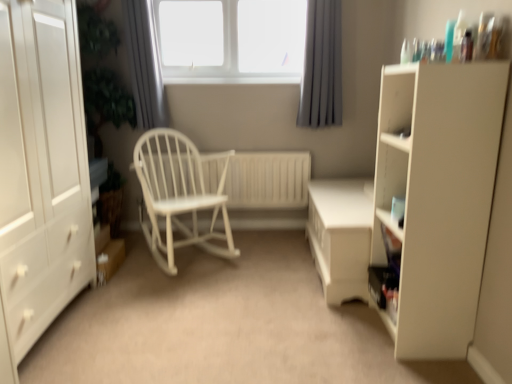
Question: Is matte white cupboard at right facing away from white glossy table at center?

Choices:
 (A) yes
 (B) no

Answer: (B)

Question: Are matte white cupboard at right and white glossy table at center making contact?

Choices:
 (A) no
 (B) yes

Answer: (A)

Question: Is matte white cupboard at right not within white glossy table at center?

Choices:
 (A) no
 (B) yes

Answer: (B)

Question: From the image's perspective, is matte white cupboard at right below white glossy table at center?

Choices:
 (A) no
 (B) yes

Answer: (A)

Question: From the image's perspective, is matte white cupboard at right above white glossy table at center?

Choices:
 (A) no
 (B) yes

Answer: (B)

Question: Is white glossy table at center wider or thinner than white wood rocking chair at center?

Choices:
 (A) thin
 (B) wide

Answer: (A)

Question: From the image's perspective, is white glossy table at center above or below white wood rocking chair at center?

Choices:
 (A) above
 (B) below

Answer: (B)

Question: Looking at the image, does white glossy table at center seem bigger or smaller compared to white wood rocking chair at center?

Choices:
 (A) small
 (B) big

Answer: (A)

Question: Is white glossy table at center in front of or behind white wood rocking chair at center in the image?

Choices:
 (A) front
 (B) behind

Answer: (A)

Question: From their relative heights in the image, would you say white wood window sill at upper center is taller or shorter than white glossy table at center?

Choices:
 (A) tall
 (B) short

Answer: (B)

Question: Is white wood window sill at upper center in front of or behind white glossy table at center in the image?

Choices:
 (A) behind
 (B) front

Answer: (A)

Question: Is point (177, 77) closer or farther from the camera than point (337, 279)?

Choices:
 (A) closer
 (B) farther

Answer: (B)

Question: Is white wood window sill at upper center situated inside white glossy table at center or outside?

Choices:
 (A) outside
 (B) inside

Answer: (A)

Question: Is gray fabric curtain at upper center, the 2th curtain viewed from the right, inside the boundaries of white wooden radiator at center, or outside?

Choices:
 (A) inside
 (B) outside

Answer: (B)

Question: Is point (137, 91) positioned closer to the camera than point (258, 160)?

Choices:
 (A) closer
 (B) farther

Answer: (A)